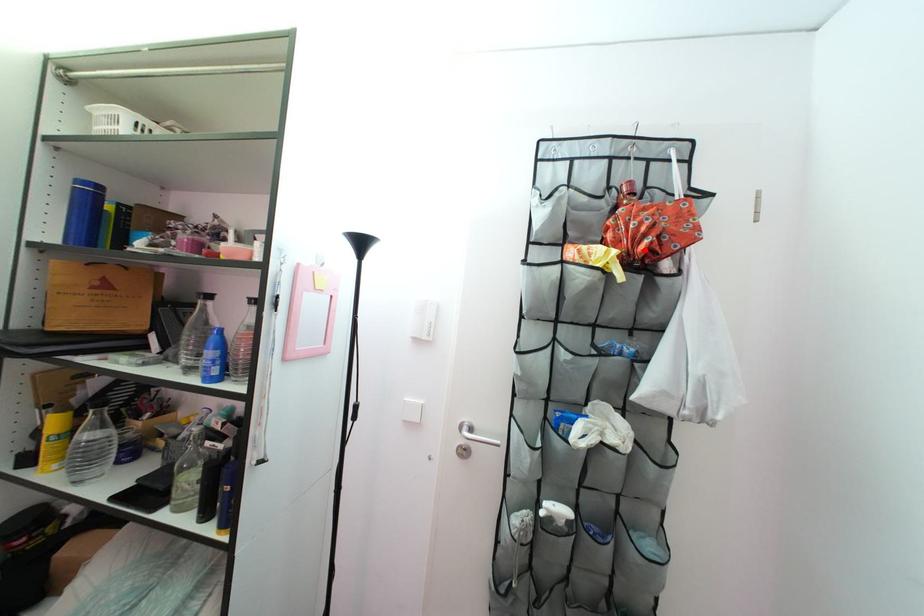
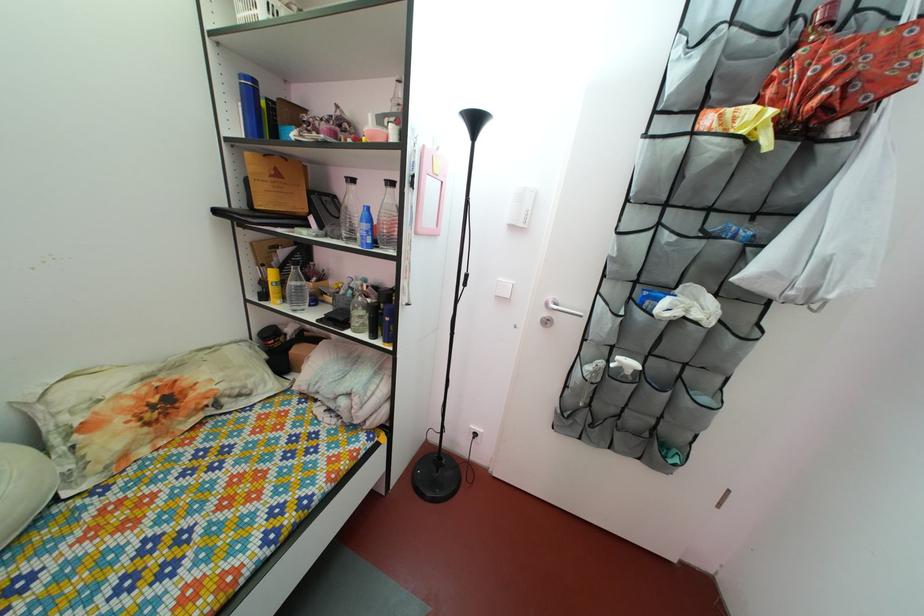
Locate, in the second image, the point that corresponds to the highlighted location in the first image.

(816, 103)